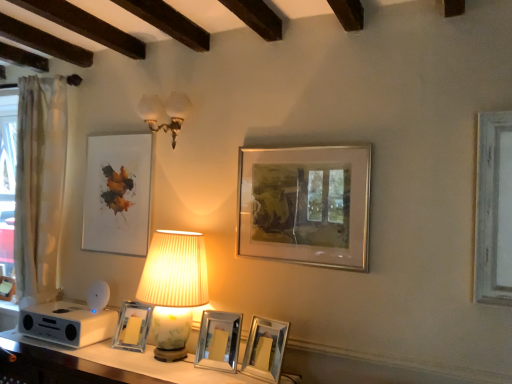
Question: Can you confirm if white sheer curtain at left is positioned to the left of silver/metallic picture frame at center-right, which appears as the fifth picture frame when viewed from the left?

Choices:
 (A) yes
 (B) no

Answer: (A)

Question: From the image's perspective, is white sheer curtain at left on silver/metallic picture frame at center-right, the 1th picture frame when ordered from right to left?

Choices:
 (A) yes
 (B) no

Answer: (B)

Question: Is silver/metallic picture frame at center-right, which appears as the fifth picture frame when viewed from the left, at the back of white sheer curtain at left?

Choices:
 (A) yes
 (B) no

Answer: (B)

Question: From a real-world perspective, is white sheer curtain at left positioned under silver/metallic picture frame at center-right, the 1th picture frame when ordered from right to left, based on gravity?

Choices:
 (A) yes
 (B) no

Answer: (A)

Question: Can we say white sheer curtain at left lies outside silver/metallic picture frame at center-right, the 1th picture frame when ordered from right to left?

Choices:
 (A) yes
 (B) no

Answer: (A)

Question: Is white sheer curtain at left surrounding silver/metallic picture frame at center-right, which appears as the fifth picture frame when viewed from the left?

Choices:
 (A) no
 (B) yes

Answer: (A)

Question: From the image's perspective, is white glass sconce at upper center, which ranks as the 1th lamp in top-to-bottom order, on matte white picture frame at upper left, which is counted as the first picture frame, starting from the left?

Choices:
 (A) no
 (B) yes

Answer: (B)

Question: From a real-world perspective, is white glass sconce at upper center, which ranks as the 1th lamp in top-to-bottom order, positioned over matte white picture frame at upper left, which is counted as the fifth picture frame, starting from the right, based on gravity?

Choices:
 (A) yes
 (B) no

Answer: (A)

Question: Does white glass sconce at upper center, which ranks as the 1th lamp in top-to-bottom order, have a greater height compared to matte white picture frame at upper left, which is counted as the first picture frame, starting from the left?

Choices:
 (A) yes
 (B) no

Answer: (B)

Question: Is white glass sconce at upper center, positioned as the second lamp in bottom-to-top order, at the left side of matte white picture frame at upper left, which is counted as the fifth picture frame, starting from the right?

Choices:
 (A) yes
 (B) no

Answer: (B)

Question: Considering the relative positions of white glass sconce at upper center, positioned as the second lamp in bottom-to-top order, and matte white picture frame at upper left, which is counted as the first picture frame, starting from the left, in the image provided, is white glass sconce at upper center, positioned as the second lamp in bottom-to-top order, in front of matte white picture frame at upper left, which is counted as the first picture frame, starting from the left,?

Choices:
 (A) no
 (B) yes

Answer: (B)

Question: Could you tell me if white glass sconce at upper center, positioned as the second lamp in bottom-to-top order, is turned towards matte white picture frame at upper left, which is counted as the fifth picture frame, starting from the right?

Choices:
 (A) yes
 (B) no

Answer: (B)

Question: Can you confirm if matte white picture frame at upper left, which is counted as the first picture frame, starting from the left, is smaller than clear glass photo frame at center, the second picture frame from the left?

Choices:
 (A) no
 (B) yes

Answer: (A)